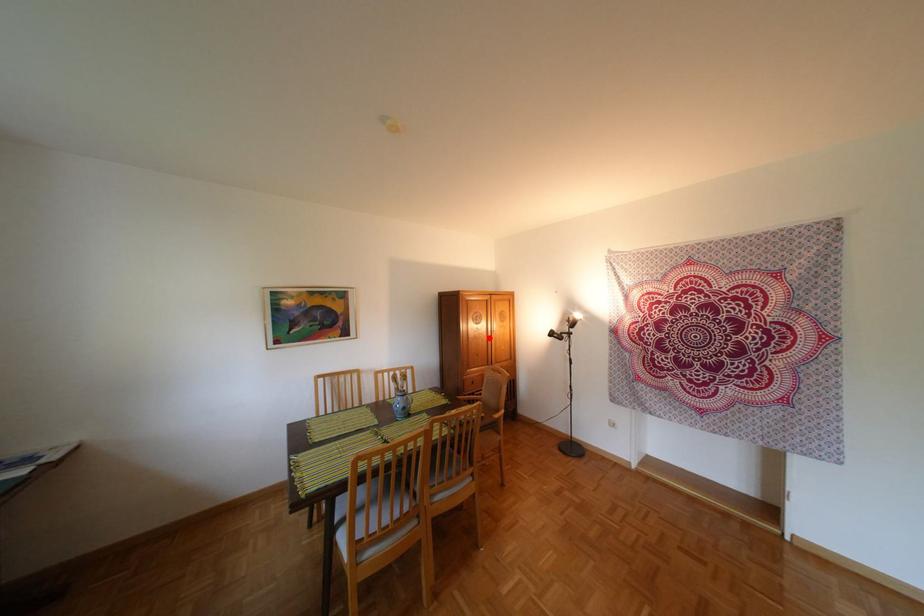
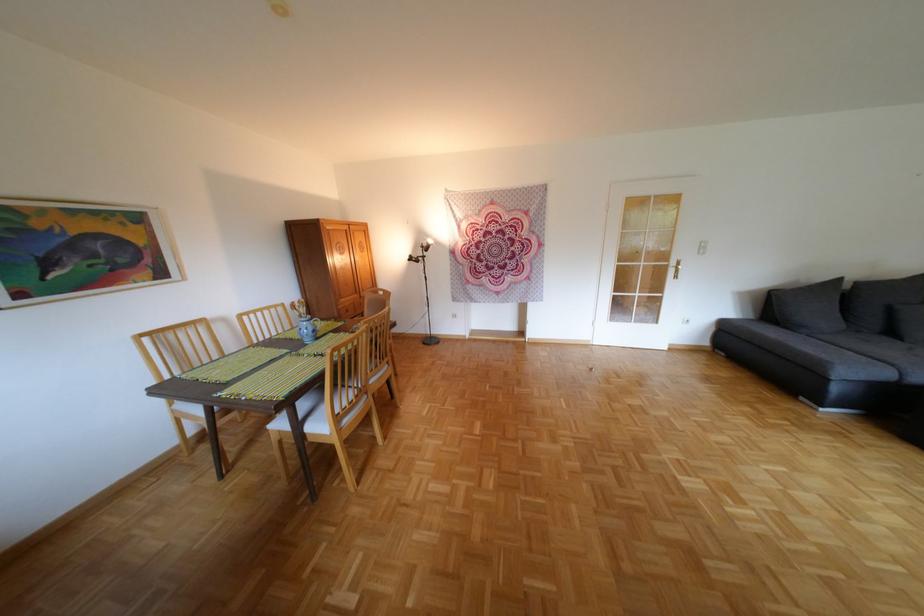
In the second image, find the point that corresponds to the highlighted location in the first image.

(356, 268)